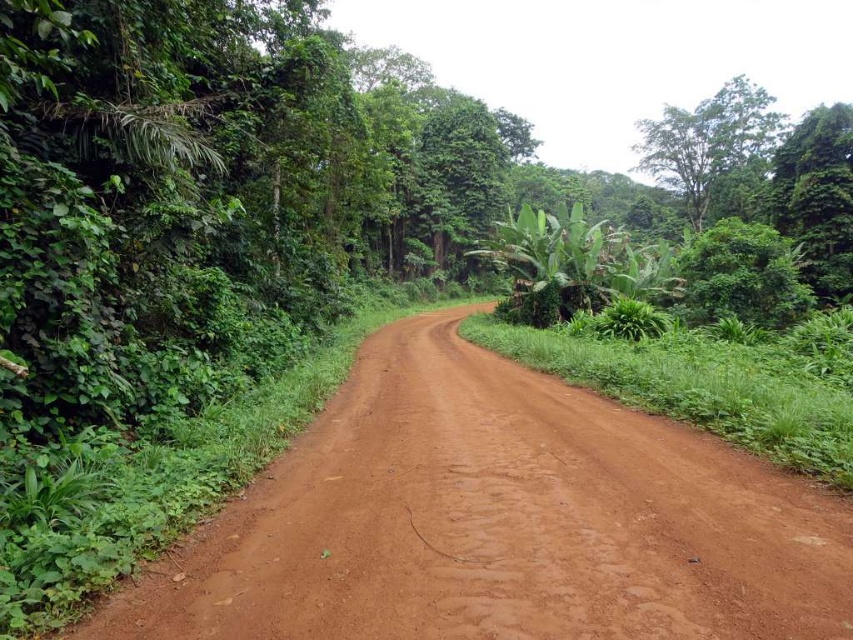
Identify the location of dusty brown dirt track at center. (498, 520).

Which of these two, dusty brown dirt track at center or green leafy tree at upper right, stands shorter?

dusty brown dirt track at center is shorter.

Who is more distant from viewer, (x=643, y=598) or (x=712, y=148)?

Point (x=712, y=148)

In order to click on dusty brown dirt track at center in this screenshot , I will do `click(498, 520)`.